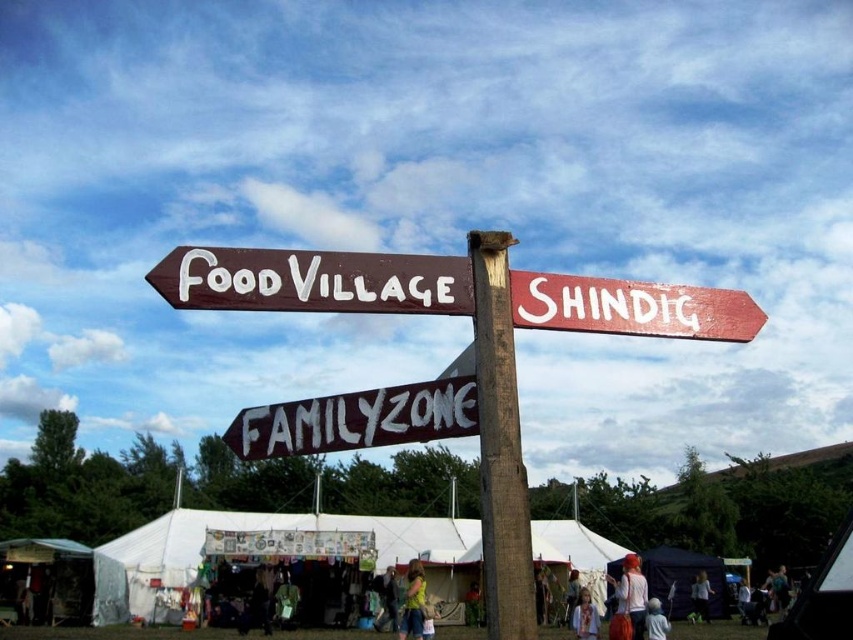
Question: From the image, what is the correct spatial relationship of red fabric headscarf at lower right in relation to white fabric person at lower center?

Choices:
 (A) right
 (B) left

Answer: (B)

Question: Is brown wooden pole at center wider than white fabric person at lower center?

Choices:
 (A) no
 (B) yes

Answer: (B)

Question: Which of the following is the closest to the observer?

Choices:
 (A) brown wooden pole at center
 (B) red fabric headscarf at lower right
 (C) wooden signpost at upper right
 (D) white painted wood sign at center

Answer: (A)

Question: Does brown wooden pole at center appear under light brown fabric dress at lower center?

Choices:
 (A) no
 (B) yes

Answer: (A)

Question: Estimate the real-world distances between objects in this image. Which object is farther from the white painted wood sign at center?

Choices:
 (A) white canvas tent at lower center
 (B) light brown fabric dress at lower center
 (C) brown wooden signpost at center

Answer: (A)

Question: Which point is closer to the camera?

Choices:
 (A) white fabric person at lower center
 (B) brown wooden signpost at center

Answer: (B)